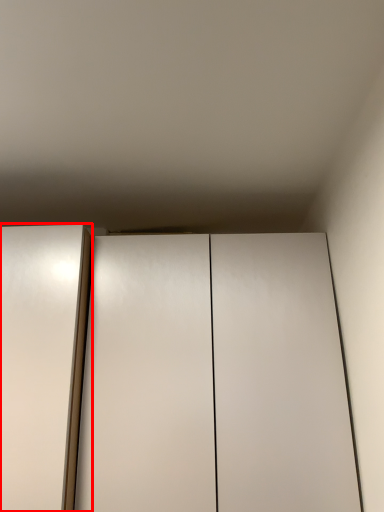
Question: From the image, what is the correct spatial relationship of elevator (annotated by the red box) in relation to cupboard?

Choices:
 (A) right
 (B) left

Answer: (B)